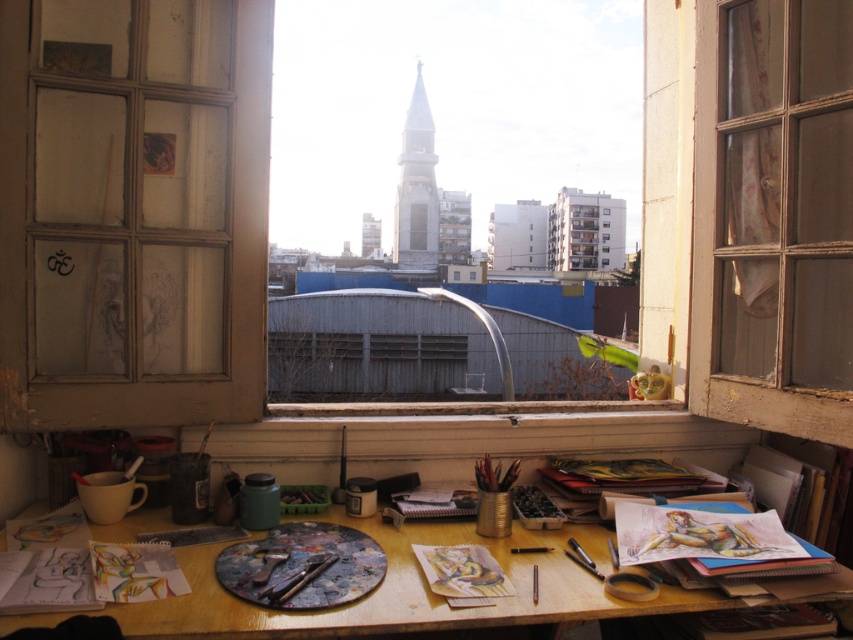
You are an artist who needs to move a large canvas from the wooden table at center to the wooden window frame at left to get better lighting. Given that the canvas is 30 inches wide, will it fit through the space between them?

The distance between the wooden window frame at left and wooden table at center is 31.03 inches. Since the canvas is 30 inches wide, it will fit through the space between them.

You are an artist who wants to hang a new painting on the wooden frame at center. There is a point marked at coordinates (773, 216). Is this point on the wooden frame at center?

Yes, the point (773, 216) is on the wooden frame at center, so you can hang the painting there.

You are an artist who needs to place a large canvas on your desk. Given that the wooden window frame at left and wooden table at center are in the room, which object is larger and can accommodate the canvas?

The wooden table at center is larger than the wooden window frame at left, so it can accommodate the large canvas.